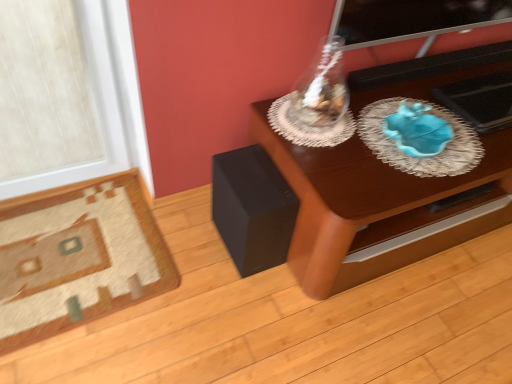
Identify the location of empty space that is in between black matte speaker at lower left and carpeted rug at lower left. (179, 259).